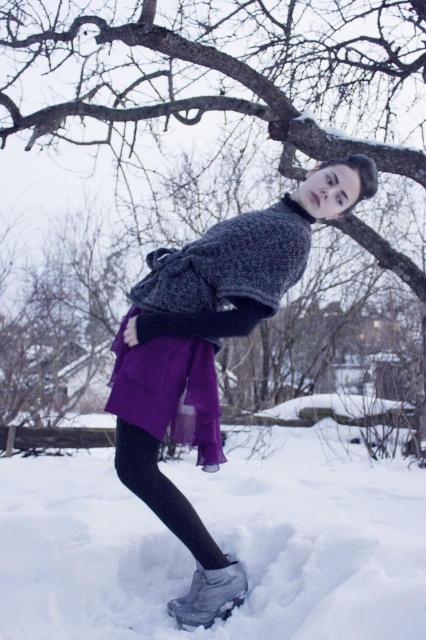
Question: Which object is the farthest from the white fluffy snow at lower center?

Choices:
 (A) smooth bark tree at upper center
 (B) matte gray sweater at center
 (C) purple chiffon skirt at lower center

Answer: (A)

Question: Does white fluffy snow at lower center come in front of smooth bark tree at upper center?

Choices:
 (A) yes
 (B) no

Answer: (A)

Question: Can you confirm if matte gray sweater at center is positioned below purple chiffon skirt at lower center?

Choices:
 (A) no
 (B) yes

Answer: (A)

Question: From the image, what is the correct spatial relationship of smooth bark tree at upper center in relation to matte gray sweater at center?

Choices:
 (A) above
 (B) below

Answer: (A)

Question: Which of the following is the farthest from the observer?

Choices:
 (A) purple chiffon skirt at lower center
 (B) knitted gray sweater at center

Answer: (B)

Question: Which point is farther from the camera taking this photo?

Choices:
 (A) (137, 413)
 (B) (291, 88)
 (C) (296, 205)
 (D) (264, 310)

Answer: (B)